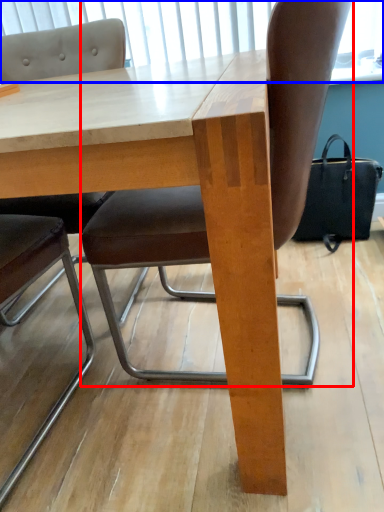
Question: Which object is closer to the camera taking this photo, chair (highlighted by a red box) or window screen (highlighted by a blue box)?

Choices:
 (A) chair
 (B) window screen

Answer: (A)